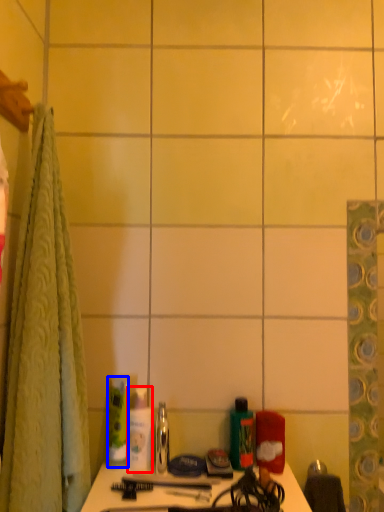
Question: Which point is further to the camera, toiletry (highlighted by a red box) or toiletry (highlighted by a blue box)?

Choices:
 (A) toiletry
 (B) toiletry

Answer: (B)